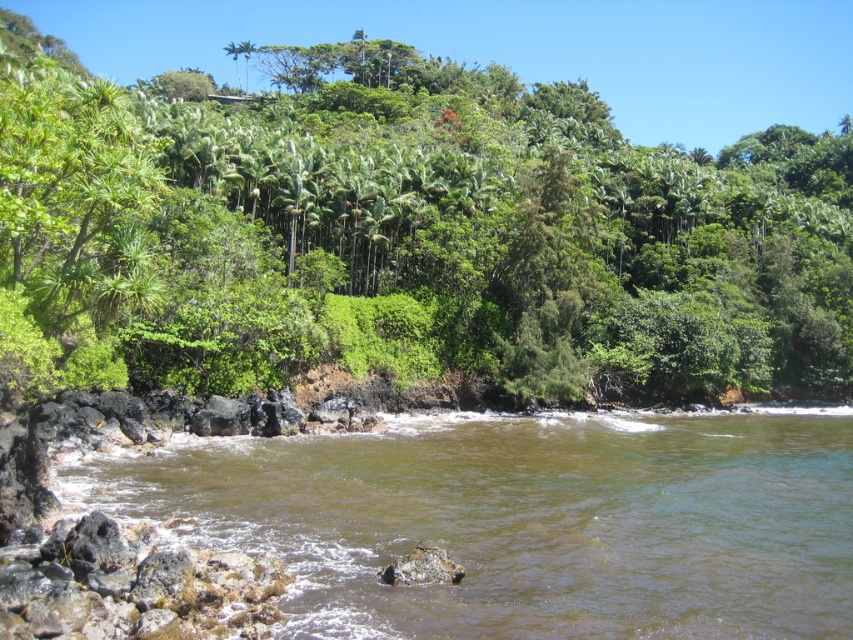
What do you see at coordinates (523, 522) in the screenshot?
I see `brown rocky river at lower left` at bounding box center [523, 522].

Measure the distance between brown rocky river at lower left and camera.

brown rocky river at lower left and camera are 12.50 meters apart from each other.

The height and width of the screenshot is (640, 853). In order to click on brown rocky river at lower left in this screenshot , I will do `click(523, 522)`.

How distant is green leafy tree at upper center from green leafy palm tree at upper center?

The distance of green leafy tree at upper center from green leafy palm tree at upper center is 280.55 feet.

Based on the photo, can you confirm if green leafy tree at upper center is taller than green leafy palm tree at upper center?

Indeed, green leafy tree at upper center has a greater height compared to green leafy palm tree at upper center.

Which is in front, point (782, 182) or point (252, 51)?

Positioned in front is point (782, 182).

Where is `green leafy tree at upper center`? green leafy tree at upper center is located at coordinates (405, 230).

From the picture: Is green leafy tree at upper center below brown rocky river at lower left?

Actually, green leafy tree at upper center is above brown rocky river at lower left.

Identify the location of green leafy tree at upper center. (405, 230).